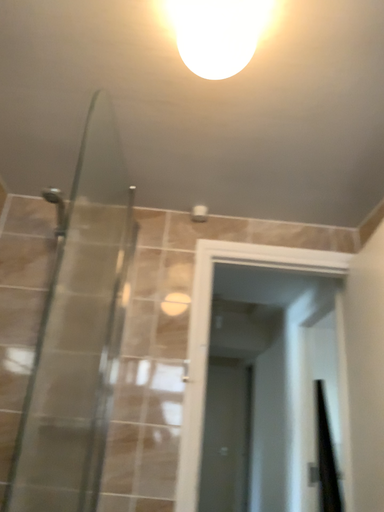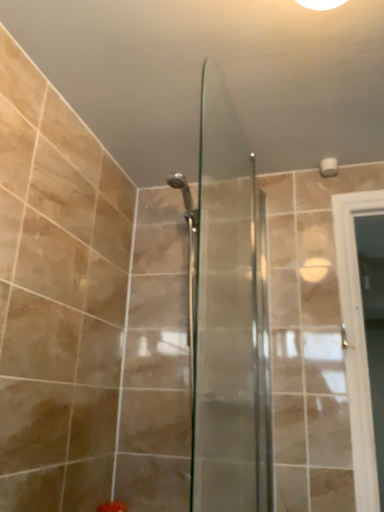
Question: How did the camera likely rotate when shooting the video?

Choices:
 (A) rotated left
 (B) rotated right

Answer: (A)